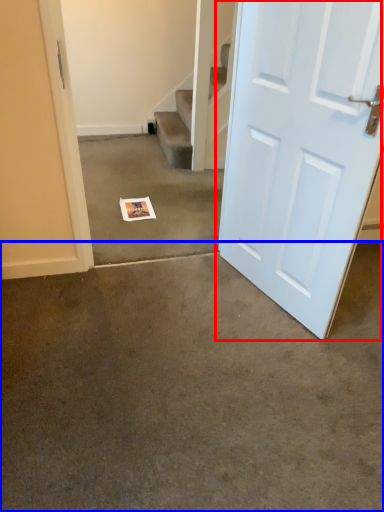
Question: Which point is closer to the camera, door (highlighted by a red box) or concrete (highlighted by a blue box)?

Choices:
 (A) door
 (B) concrete

Answer: (B)